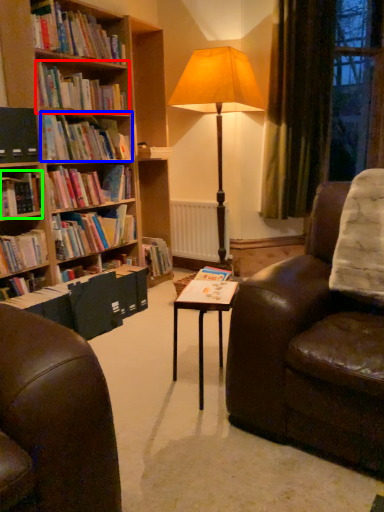
Question: Which is farther away from book (highlighted by a red box)? book (highlighted by a blue box) or book (highlighted by a green box)?

Choices:
 (A) book
 (B) book

Answer: (B)